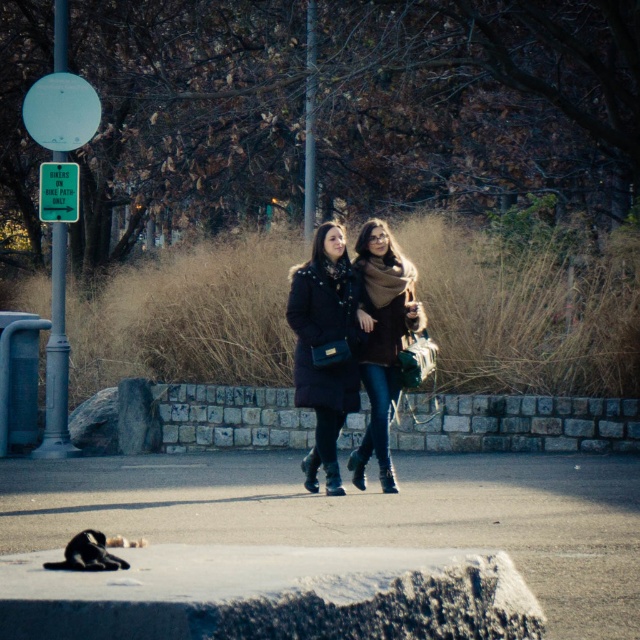
Which is in front, point (168, 525) or point (364, 288)?

Point (168, 525) is more forward.

Is point (195, 456) closer to viewer compared to point (420, 321)?

No, it is not.

Where is `concrete at center`? This screenshot has height=640, width=640. concrete at center is located at coordinates (364, 515).

Does matte black coat at center have a greater height compared to brown woolen scarf at center?

No, matte black coat at center is not taller than brown woolen scarf at center.

Which is below, matte black coat at center or brown woolen scarf at center?

brown woolen scarf at center is below.

Between point (349, 372) and point (372, 262), which one is positioned in front?

Point (349, 372) is in front.

Identify the location of matte black coat at center. (324, 348).

Is concrete at center to the right of matte black coat at center from the viewer's perspective?

No, concrete at center is not to the right of matte black coat at center.

What do you see at coordinates (364, 515) in the screenshot?
I see `concrete at center` at bounding box center [364, 515].

Find the location of a particular element. The height and width of the screenshot is (640, 640). concrete at center is located at coordinates (364, 515).